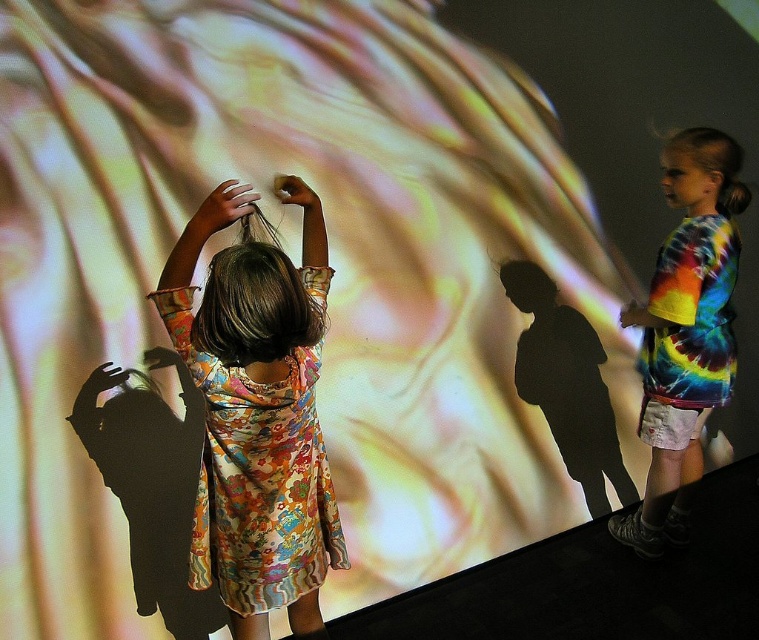
Can you confirm if light brown hair at center is smaller than matte black hand at upper right?

No.

Is light brown hair at center bigger than matte black hand at upper right?

Correct, light brown hair at center is larger in size than matte black hand at upper right.

At what (x,y) coordinates should I click in order to perform the action: click on light brown hair at center. Please return your answer as a coordinate pair (x, y). This screenshot has height=640, width=759. Looking at the image, I should click on (221, 209).

Can you confirm if light brown hair at center is positioned to the left of matte skin hand at center?

Indeed, light brown hair at center is positioned on the left side of matte skin hand at center.

Image resolution: width=759 pixels, height=640 pixels. Describe the element at coordinates (221, 209) in the screenshot. I see `light brown hair at center` at that location.

Locate an element on the screen. This screenshot has height=640, width=759. light brown hair at center is located at coordinates (221, 209).

Does floral dress at center have a greater width compared to tie-dye fabric shirt at right?

Yes, floral dress at center is wider than tie-dye fabric shirt at right.

Can you confirm if floral dress at center is positioned above tie-dye fabric shirt at right?

Actually, floral dress at center is below tie-dye fabric shirt at right.

Who is more distant from viewer, (x=200, y=371) or (x=676, y=390)?

The point (x=676, y=390) is more distant.

Locate an element on the screen. floral dress at center is located at coordinates (257, 426).